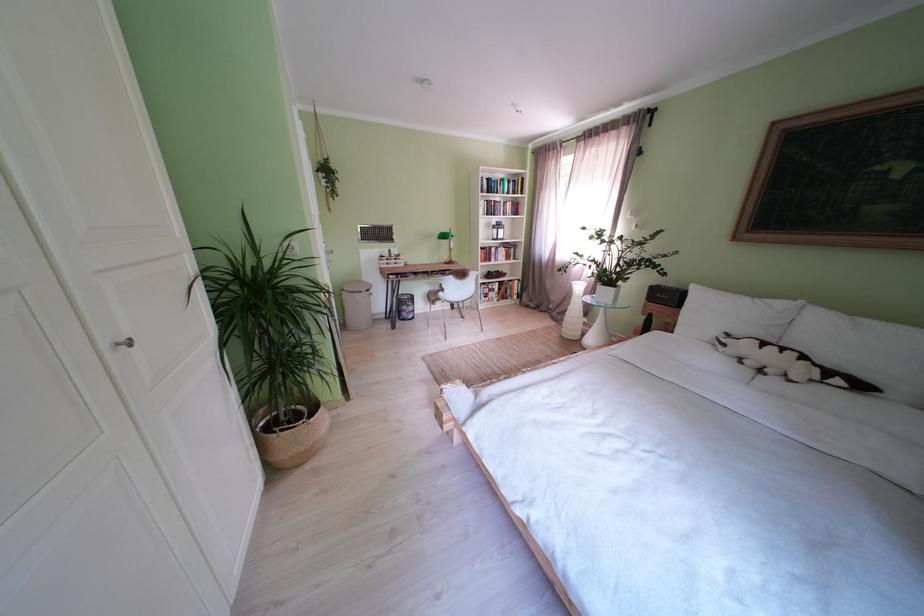
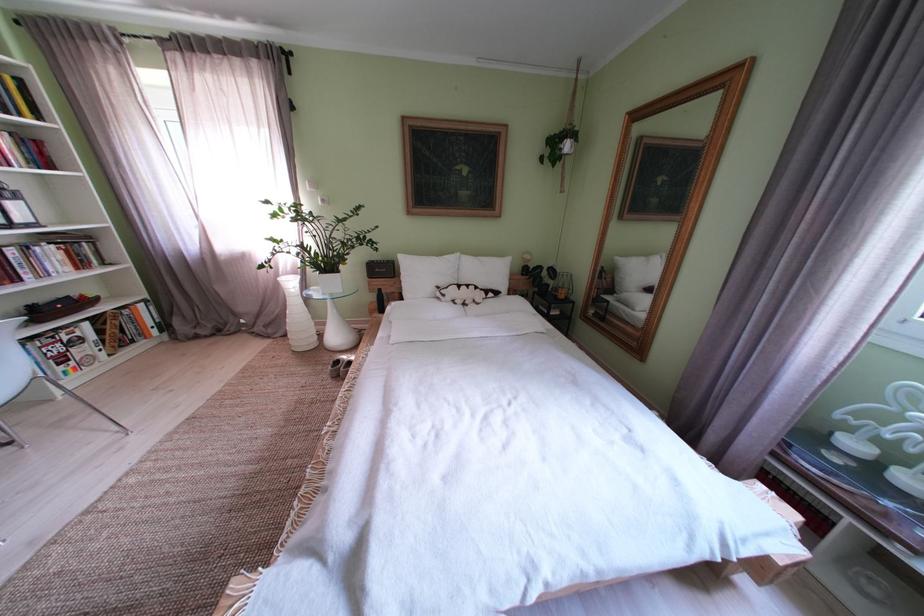
Locate, in the second image, the point that corresponds to pixel 520 209 in the first image.

(16, 145)